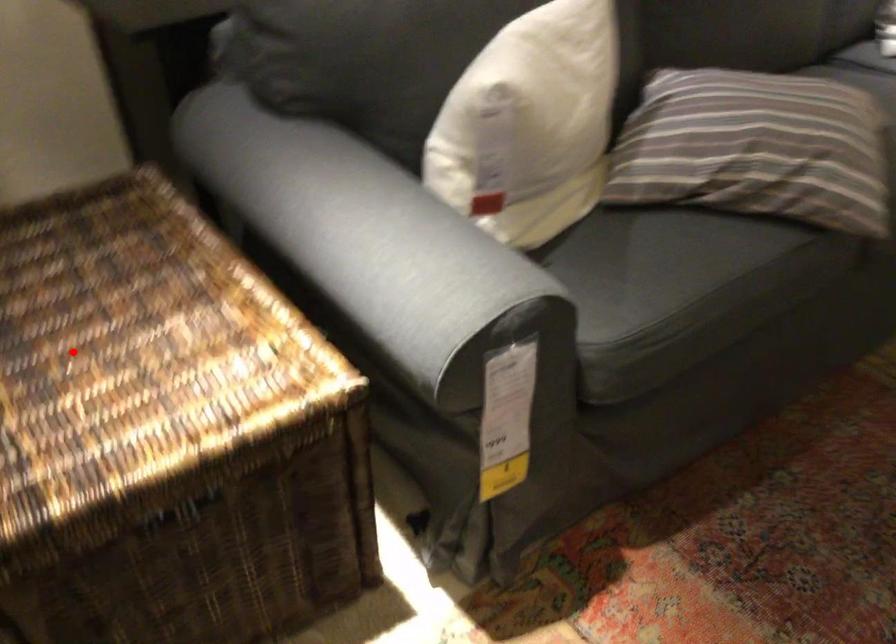
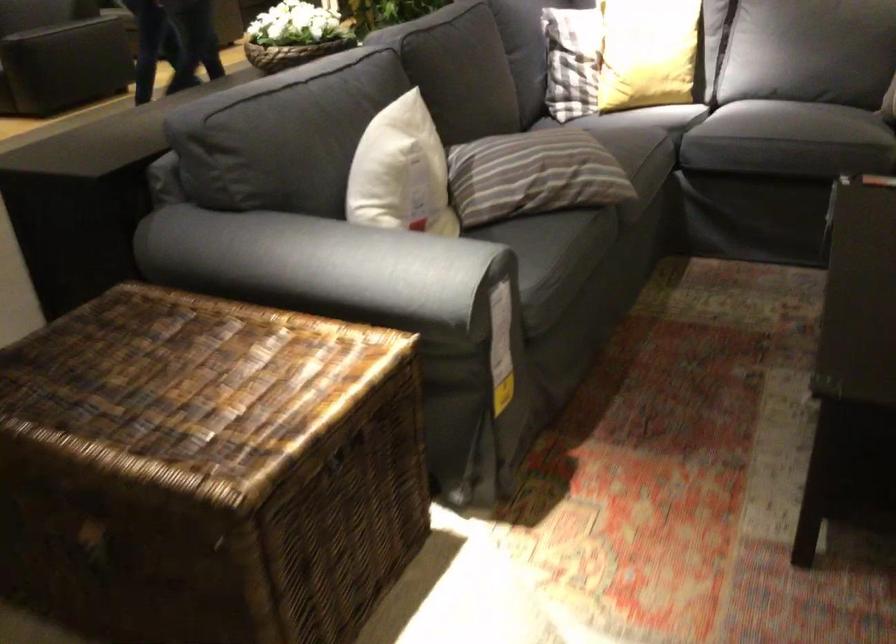
Locate, in the second image, the point that corresponds to the highlighted location in the first image.

(195, 389)